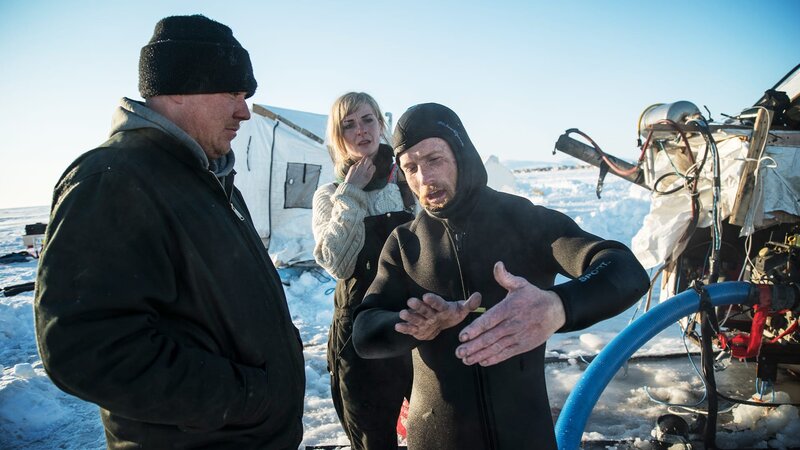
This screenshot has height=450, width=800. I want to click on hood, so click(x=441, y=118).